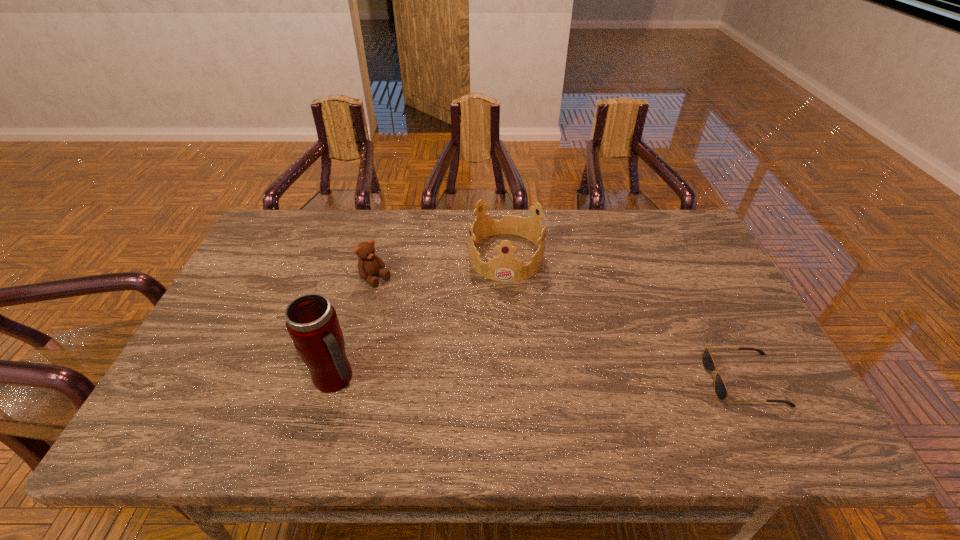
The height and width of the screenshot is (540, 960). I want to click on free space on the desktop that is between the tallest object and the sunglasses and is positioned on the face of the teddy bear, so coord(501,379).

Where is `vacant space on the desktop that is between the thermos bottle and the shortest object and is positioned on the front-facing side of the tiara`? The width and height of the screenshot is (960, 540). vacant space on the desktop that is between the thermos bottle and the shortest object and is positioned on the front-facing side of the tiara is located at coordinates [499, 379].